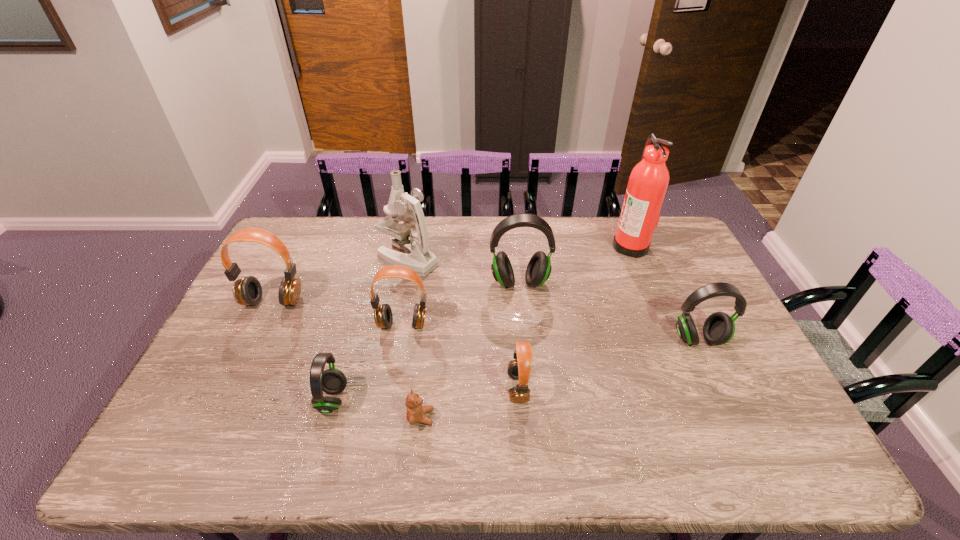
At what (x,y) coordinates should I click in order to perform the action: click on object that is the seventh closest to the smallest black headset. Please return your answer as a coordinate pair (x, y). Looking at the image, I should click on (719, 328).

What are the coordinates of `object that stands as the seventh closest to the microscope` in the screenshot? It's located at point(649,179).

Identify which headset is the fourth nearest to the shortest object. Please provide its 2D coordinates. Your answer should be formatted as a tuple, i.e. [(x, y)], where the tuple contains the x and y coordinates of a point satisfying the conditions above.

[(538, 270)]

Select which headset appears as the closest to the second nearest brown headset. Please provide its 2D coordinates. Your answer should be formatted as a tuple, i.e. [(x, y)], where the tuple contains the x and y coordinates of a point satisfying the conditions above.

[(332, 381)]

Where is `black headset identified as the second closest to the fire extinguisher`? The width and height of the screenshot is (960, 540). black headset identified as the second closest to the fire extinguisher is located at coordinates (719, 328).

Identify the location of the third closest black headset to the gray microscope. (x=719, y=328).

Point out which brown headset is positioned as the second nearest to the teddy bear. Please provide its 2D coordinates. Your answer should be formatted as a tuple, i.e. [(x, y)], where the tuple contains the x and y coordinates of a point satisfying the conditions above.

[(383, 316)]

Find the location of a particular element. The height and width of the screenshot is (540, 960). the second closest brown headset to the leftmost brown headset is located at coordinates (519, 369).

Find the location of a particular element. This screenshot has width=960, height=540. free space that satisfies the following two spatial constraints: 1. on the ear cups of the second smallest brown headset; 2. on the ear cups of the fifth headset from right to left is located at coordinates (390, 400).

Where is `free space that satisfies the following two spatial constraints: 1. on the ear cups of the second nearest black headset; 2. on the ear cups of the nearest brown headset`? Image resolution: width=960 pixels, height=540 pixels. free space that satisfies the following two spatial constraints: 1. on the ear cups of the second nearest black headset; 2. on the ear cups of the nearest brown headset is located at coordinates (721, 388).